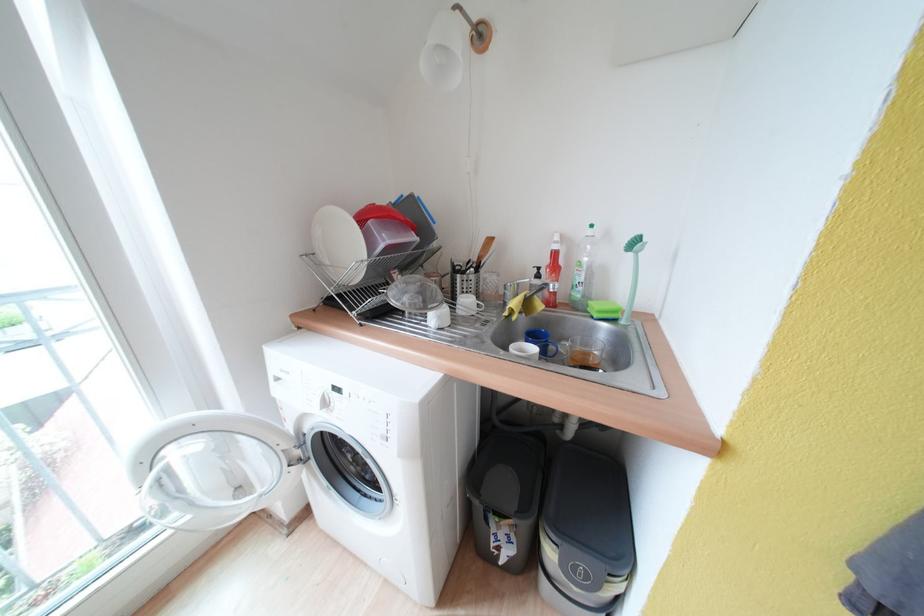
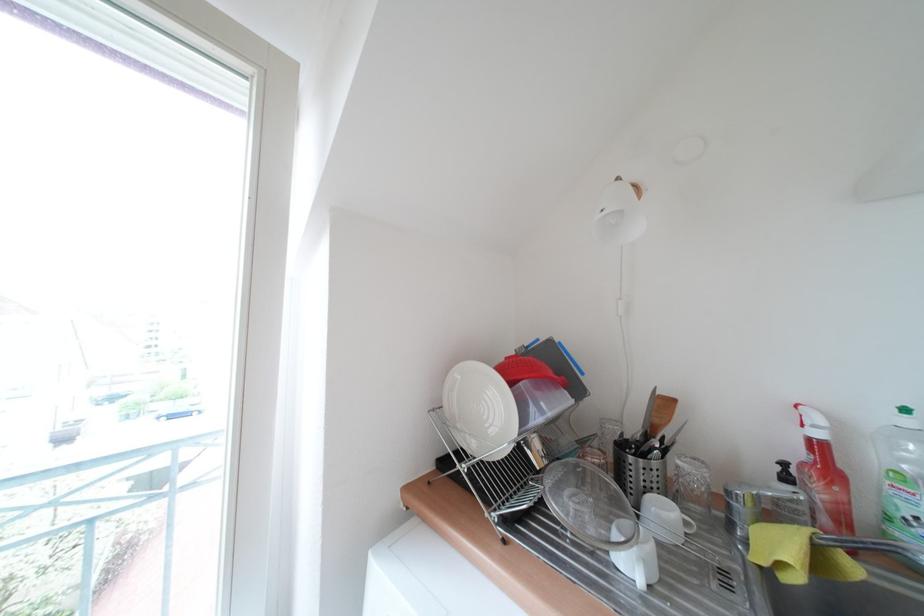
The point at [416,307] is marked in the first image. Where is the corresponding point in the second image?

(582, 515)